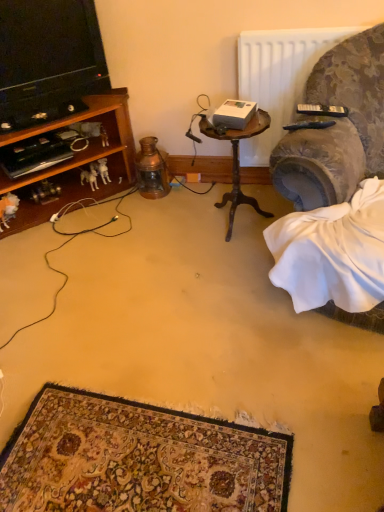
Where is `empty space that is in between white plastic dog at lower left and wooden table at center`? empty space that is in between white plastic dog at lower left and wooden table at center is located at coordinates pyautogui.click(x=166, y=211).